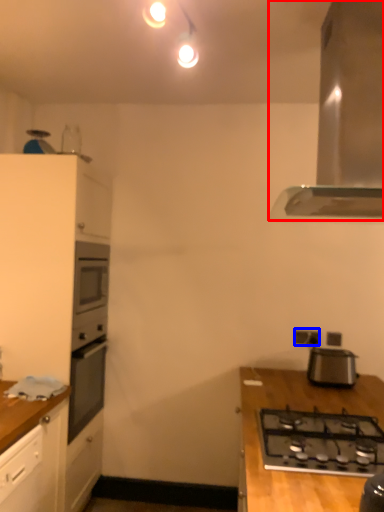
Question: Which point is closer to the camera, home appliance (highlighted by a red box) or electric outlet (highlighted by a blue box)?

Choices:
 (A) home appliance
 (B) electric outlet

Answer: (A)